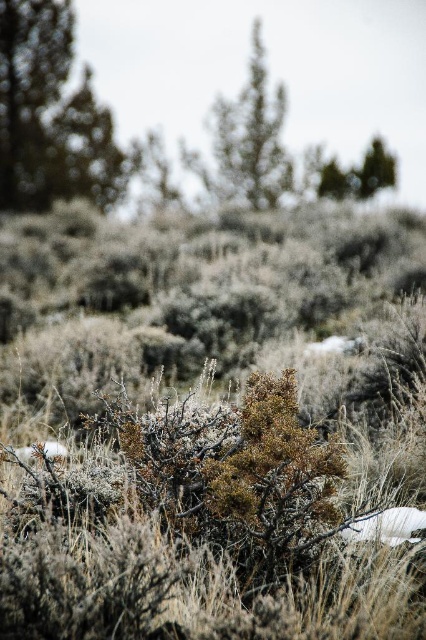
Does point (43, 102) lie in front of point (218, 157)?

Yes, it is.

Is green textured tree at upper left bigger than green textured tree at upper center?

No.

Who is more forward, (34,56) or (265,125)?

Positioned in front is point (34,56).

You are a GUI agent. You are given a task and a screenshot of the screen. Output one action in this format:
    pyautogui.click(x=<x>, y=<y>)
    Task: Click on the green textured tree at upper left
    This screenshot has height=640, width=426.
    Given the screenshot: What is the action you would take?
    pyautogui.click(x=51, y=115)